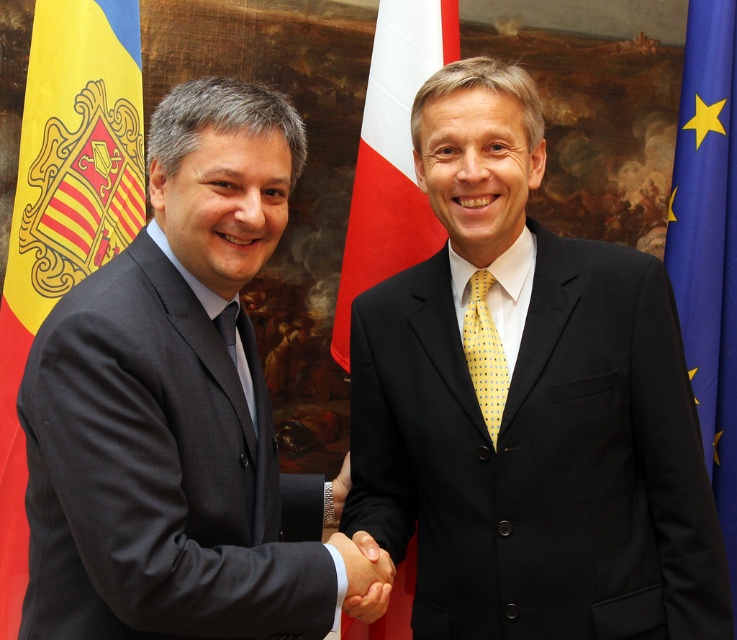
Question: Is blue fabric flag at right positioned in front of smooth skin hand at center?

Choices:
 (A) no
 (B) yes

Answer: (A)

Question: Does yellowmaterial/textureflag at left come in front of blue fabric flag at right?

Choices:
 (A) no
 (B) yes

Answer: (B)

Question: Among these points, which one is farthest from the camera?

Choices:
 (A) (345, 474)
 (B) (385, 90)
 (C) (727, 336)

Answer: (C)

Question: Can you confirm if yellowmaterial/textureflag at left is wider than yellow dotted tie at center?

Choices:
 (A) no
 (B) yes

Answer: (B)

Question: Considering the real-world distances, which object is closest to the yellowmaterial/textureflag at left?

Choices:
 (A) blue fabric flag at right
 (B) smooth skin hand at center

Answer: (B)

Question: Estimate the real-world distances between objects in this image. Which object is closer to the smooth skin hand at center?

Choices:
 (A) dark gray suit at left
 (B) blue fabric flag at right
 (C) yellow dotted tie at center

Answer: (A)